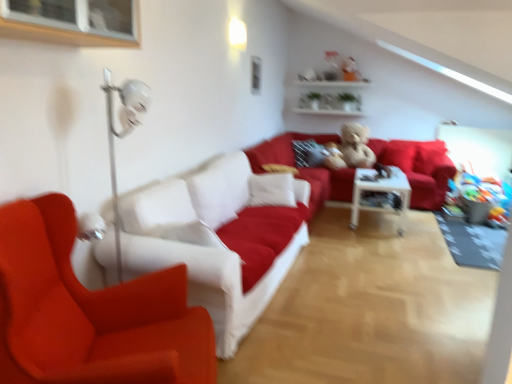
Question: In the image, is white glossy table at center positioned in front of or behind fluffy beige teddy bear at center?

Choices:
 (A) front
 (B) behind

Answer: (A)

Question: In terms of height, does white glossy table at center look taller or shorter compared to fluffy beige teddy bear at center?

Choices:
 (A) short
 (B) tall

Answer: (A)

Question: Estimate the real-world distances between objects in this image. Which object is closer to the white fabric couch at center, the 1th studio couch when ordered from left to right?

Choices:
 (A) velvet red couch at center, which appears as the first studio couch when viewed from the back
 (B) white glossy table at center
 (C) matte red chair at left
 (D) fluffy beige teddy bear at center
 (E) velvet red pillow at center

Answer: (C)

Question: Estimate the real-world distances between objects in this image. Which object is closer to the white fabric couch at center, positioned as the second studio couch in back-to-front order?

Choices:
 (A) velvet red pillow at center
 (B) matte red chair at left
 (C) white glossy table at center
 (D) fluffy beige teddy bear at center
 (E) white glossy shelves at upper center

Answer: (B)